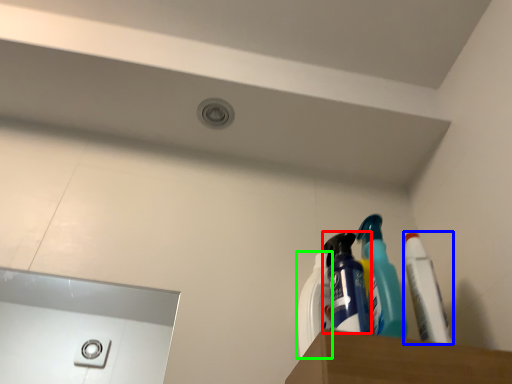
Question: Considering the real-world distances, which object is farthest from cleaning product (highlighted by a red box)? toothpaste (highlighted by a blue box) or cleaning product (highlighted by a green box)?

Choices:
 (A) toothpaste
 (B) cleaning product

Answer: (A)